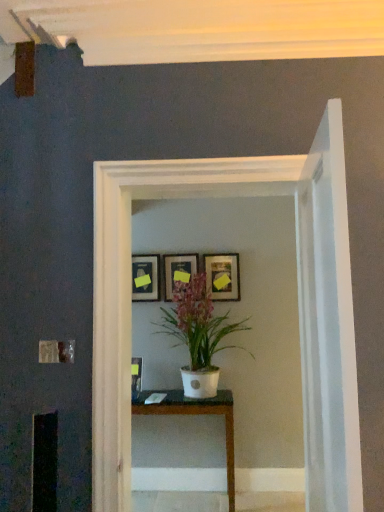
Question: Does matte black picture frame at upper center, which is counted as the 1th picture frame, starting from the left, have a smaller size compared to white glossy table at center?

Choices:
 (A) no
 (B) yes

Answer: (B)

Question: From a real-world perspective, is matte black picture frame at upper center, which is counted as the 1th picture frame, starting from the left, over white glossy table at center?

Choices:
 (A) yes
 (B) no

Answer: (A)

Question: Is matte black picture frame at upper center, the 3th picture frame positioned from the right, far from white glossy table at center?

Choices:
 (A) no
 (B) yes

Answer: (A)

Question: From the image's perspective, would you say matte black picture frame at upper center, the 3th picture frame positioned from the right, is shown under white glossy table at center?

Choices:
 (A) no
 (B) yes

Answer: (A)

Question: Considering the relative sizes of matte black picture frame at upper center, which is counted as the 1th picture frame, starting from the left, and white glossy table at center in the image provided, is matte black picture frame at upper center, which is counted as the 1th picture frame, starting from the left, wider than white glossy table at center?

Choices:
 (A) no
 (B) yes

Answer: (A)

Question: Visually, is matte black picture frame at center, the third picture frame viewed from the left, positioned to the left or to the right of white glossy table at center?

Choices:
 (A) left
 (B) right

Answer: (B)

Question: From their relative heights in the image, would you say matte black picture frame at center, the third picture frame viewed from the left, is taller or shorter than white glossy table at center?

Choices:
 (A) tall
 (B) short

Answer: (B)

Question: Is matte black picture frame at center, the first picture frame from the right, in front of or behind white glossy table at center in the image?

Choices:
 (A) front
 (B) behind

Answer: (B)

Question: Is matte black picture frame at center, the third picture frame viewed from the left, situated inside white glossy table at center or outside?

Choices:
 (A) inside
 (B) outside

Answer: (B)

Question: Is white matte pot at center taller or shorter than matte wooden picture frame at center, which is the second picture frame from right to left?

Choices:
 (A) short
 (B) tall

Answer: (B)

Question: Is white matte pot at center bigger or smaller than matte wooden picture frame at center, which is the second picture frame from right to left?

Choices:
 (A) small
 (B) big

Answer: (B)

Question: Is point (193, 275) positioned closer to the camera than point (188, 261)?

Choices:
 (A) closer
 (B) farther

Answer: (A)

Question: In the image, is white matte pot at center positioned in front of or behind matte wooden picture frame at center, which is the second picture frame from right to left?

Choices:
 (A) behind
 (B) front

Answer: (B)

Question: In terms of size, does white glossy table at center appear bigger or smaller than white matte pot at center?

Choices:
 (A) small
 (B) big

Answer: (A)

Question: In terms of width, does white glossy table at center look wider or thinner when compared to white matte pot at center?

Choices:
 (A) thin
 (B) wide

Answer: (A)